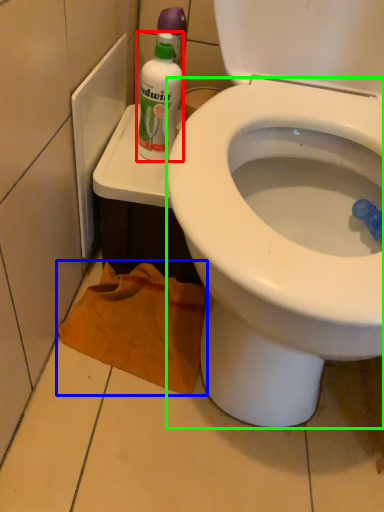
Question: Based on their relative distances, which object is farther from cleaning product (highlighted by a red box)? Choose from material (highlighted by a blue box) and bidet (highlighted by a green box).

Choices:
 (A) material
 (B) bidet

Answer: (A)